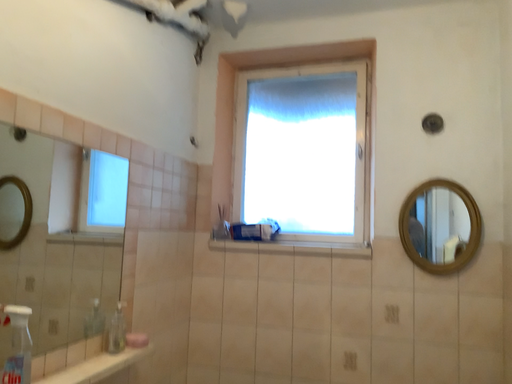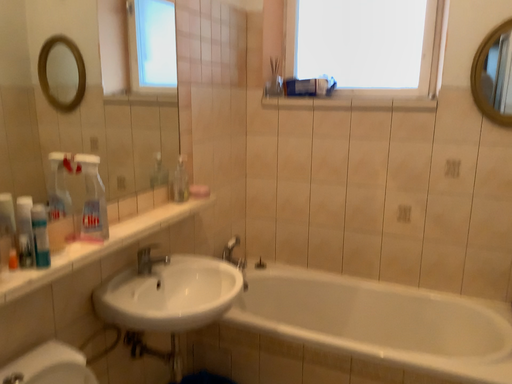
Question: Which way did the camera rotate in the video?

Choices:
 (A) rotated upward
 (B) rotated downward

Answer: (B)